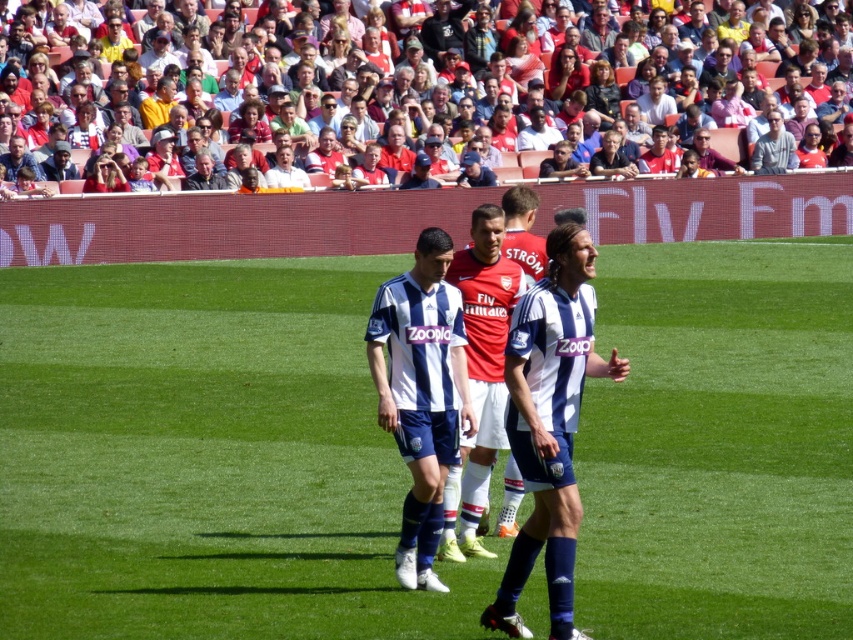
Which is in front, point (532, 624) or point (785, 131)?

Point (532, 624) is in front.

Is point (165, 589) positioned behind point (753, 154)?

No, (165, 589) is closer to viewer.

Find the location of a particular element. green grass football field at center is located at coordinates (x=204, y=458).

Find the location of a particular element. green grass football field at center is located at coordinates (204, 458).

Which of these two, white striped jersey at center or gray fabric jacket at upper center, stands taller?

white striped jersey at center

Does white striped jersey at center lie in front of gray fabric jacket at upper center?

Yes, white striped jersey at center is in front of gray fabric jacket at upper center.

Is point (451, 317) positioned behind point (213, 168)?

No, it is in front of (213, 168).

The width and height of the screenshot is (853, 640). In order to click on white striped jersey at center in this screenshot , I will do `click(421, 394)`.

Does green grass football field at center appear on the left side of gray fabric jacket at upper center?

In fact, green grass football field at center is to the right of gray fabric jacket at upper center.

Is green grass football field at center in front of gray fabric jacket at upper center?

That is True.

Is point (242, 406) positioned behind point (206, 150)?

No, it is not.

The image size is (853, 640). What are the coordinates of `green grass football field at center` in the screenshot? It's located at (204, 458).